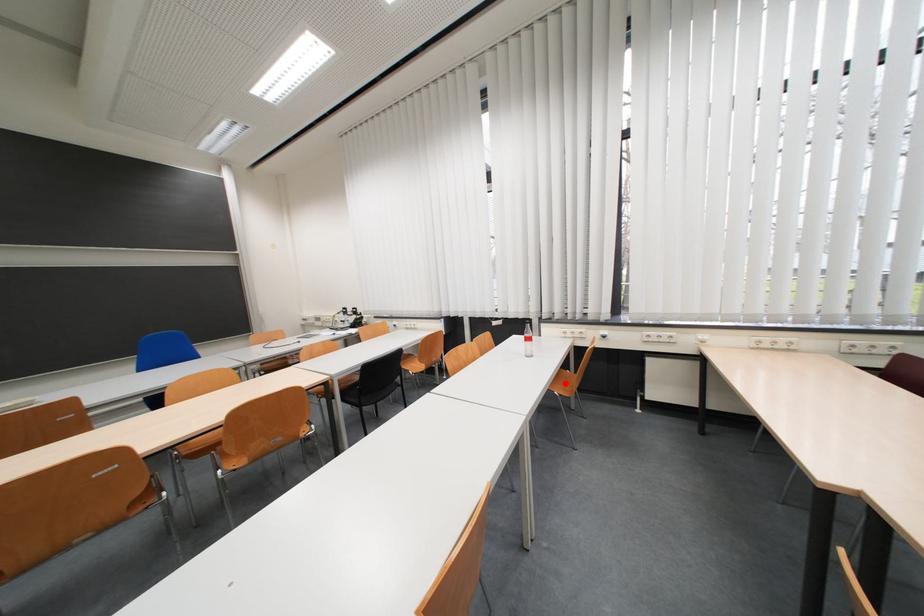
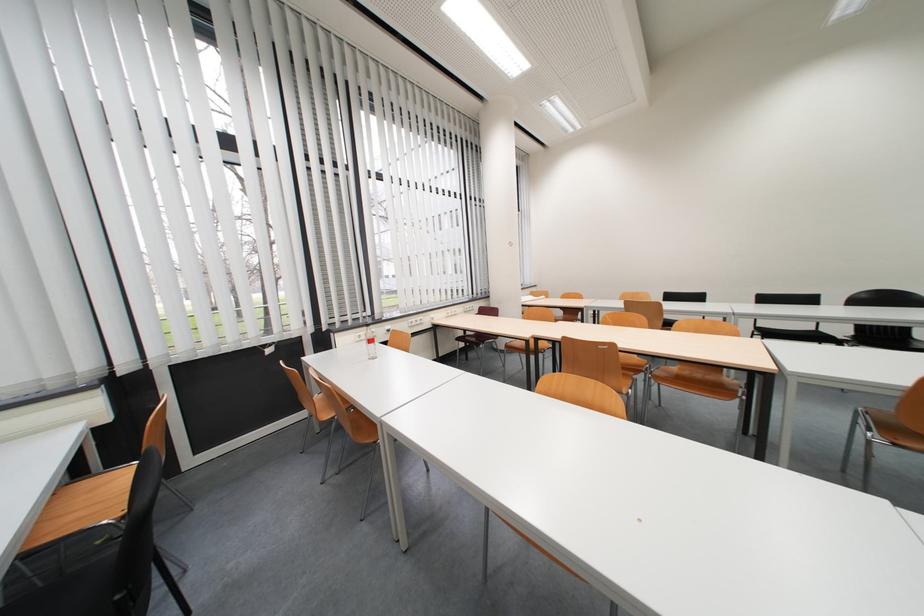
Question: I am providing you with two images of the same scene from different viewpoints. A red point is marked on the first image. Is the red point's position out of view in image 2?

Choices:
 (A) Yes
 (B) No

Answer: (A)